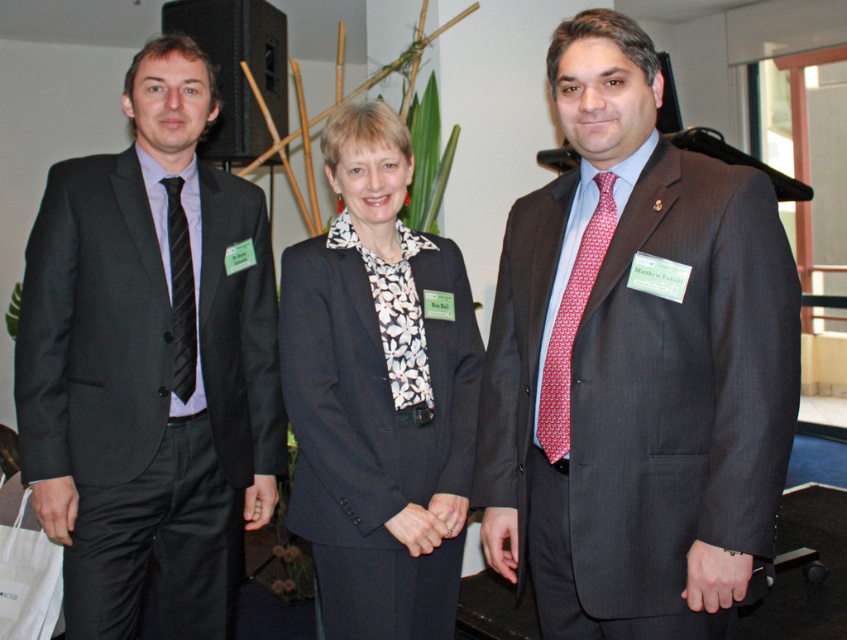
Can you confirm if matte gray suit at center is wider than matte black suit at left?

No.

Who is positioned more to the left, matte gray suit at center or matte black suit at left?

matte black suit at left is more to the left.

Is point (651, 422) farther from camera compared to point (172, 515)?

No, it is not.

Locate an element on the screen. This screenshot has height=640, width=847. matte gray suit at center is located at coordinates (635, 365).

Is black textured blazer at center further to camera compared to black striped tie at left?

No, black textured blazer at center is closer to the viewer.

Which is behind, point (407, 602) or point (169, 273)?

Point (169, 273)

This screenshot has height=640, width=847. Identify the location of black textured blazer at center. (378, 394).

Where is `black textured blazer at center`? The width and height of the screenshot is (847, 640). black textured blazer at center is located at coordinates (378, 394).

Which is in front, point (54, 429) or point (183, 304)?

Point (54, 429) is more forward.

Looking at this image, can you confirm if matte black suit at left is taller than black striped tie at left?

Correct, matte black suit at left is much taller as black striped tie at left.

The height and width of the screenshot is (640, 847). Describe the element at coordinates (150, 364) in the screenshot. I see `matte black suit at left` at that location.

Where is `matte black suit at left`? matte black suit at left is located at coordinates (150, 364).